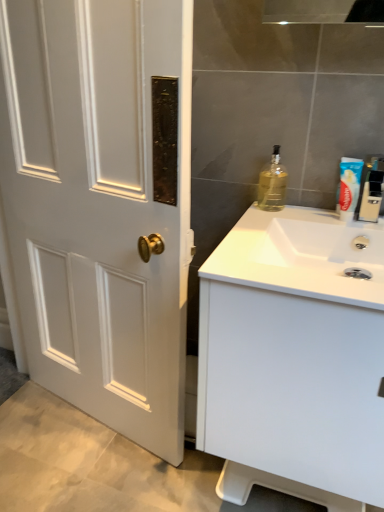
This screenshot has width=384, height=512. I want to click on blue plastic toothpaste at upper right, so click(x=348, y=187).

Where is `translucent glass bottle at upper right, the second bottle in the right-to-left sequence`? The height and width of the screenshot is (512, 384). translucent glass bottle at upper right, the second bottle in the right-to-left sequence is located at coordinates (272, 184).

Measure the distance between point (372, 175) and camera.

They are 1.07 meters apart.

This screenshot has width=384, height=512. What do you see at coordinates (301, 256) in the screenshot?
I see `white glossy sink at right` at bounding box center [301, 256].

Find the location of a particular element. This screenshot has width=384, height=512. blue plastic toothpaste at upper right is located at coordinates (348, 187).

Considering the sizes of clear plastic toothpaste tube at upper right, marked as the first bottle in a right-to-left arrangement, and translucent glass bottle at upper right, which ranks as the 1th bottle in left-to-right order, in the image, is clear plastic toothpaste tube at upper right, marked as the first bottle in a right-to-left arrangement, wider or thinner than translucent glass bottle at upper right, which ranks as the 1th bottle in left-to-right order,?

clear plastic toothpaste tube at upper right, marked as the first bottle in a right-to-left arrangement, is wider than translucent glass bottle at upper right, which ranks as the 1th bottle in left-to-right order.

How many degrees apart are the facing directions of clear plastic toothpaste tube at upper right, marked as the first bottle in a right-to-left arrangement, and translucent glass bottle at upper right, which ranks as the 1th bottle in left-to-right order?

The angle between the facing direction of clear plastic toothpaste tube at upper right, marked as the first bottle in a right-to-left arrangement, and the facing direction of translucent glass bottle at upper right, which ranks as the 1th bottle in left-to-right order, is 1.35 degrees.

Considering the relative sizes of clear plastic toothpaste tube at upper right, which appears as the second bottle when viewed from the left, and translucent glass bottle at upper right, the second bottle in the right-to-left sequence, in the image provided, is clear plastic toothpaste tube at upper right, which appears as the second bottle when viewed from the left, shorter than translucent glass bottle at upper right, the second bottle in the right-to-left sequence,?

No.

Does clear plastic toothpaste tube at upper right, which appears as the second bottle when viewed from the left, have a smaller size compared to blue plastic toothpaste at upper right?

Incorrect, clear plastic toothpaste tube at upper right, which appears as the second bottle when viewed from the left, is not smaller in size than blue plastic toothpaste at upper right.

Which is farther, (377, 160) or (344, 164)?

The point (377, 160) is farther.

Can you confirm if clear plastic toothpaste tube at upper right, marked as the first bottle in a right-to-left arrangement, is thinner than blue plastic toothpaste at upper right?

No.

From the image's perspective, between blue plastic toothpaste at upper right and white matte cabinet at right, who is located below?

white matte cabinet at right.

In terms of height, does blue plastic toothpaste at upper right look taller or shorter compared to white matte cabinet at right?

Considering their sizes, blue plastic toothpaste at upper right has less height than white matte cabinet at right.

Is blue plastic toothpaste at upper right to the right of white matte cabinet at right from the viewer's perspective?

Correct, you'll find blue plastic toothpaste at upper right to the right of white matte cabinet at right.

Locate an element on the screen. Image resolution: width=384 pixels, height=512 pixels. mouthwash located above the white matte cabinet at right (from a real-world perspective) is located at coordinates (348, 187).

Looking at this image, can we say translucent glass bottle at upper right, which ranks as the 1th bottle in left-to-right order, lies outside white matte cabinet at right?

Absolutely, translucent glass bottle at upper right, which ranks as the 1th bottle in left-to-right order, is external to white matte cabinet at right.

From the image's perspective, is translucent glass bottle at upper right, the second bottle in the right-to-left sequence, above white matte cabinet at right?

Yes, from the image's perspective, translucent glass bottle at upper right, the second bottle in the right-to-left sequence, is on top of white matte cabinet at right.

Where is `bathroom cabinet that is below the translucent glass bottle at upper right, which ranks as the 1th bottle in left-to-right order (from the image's perspective)`? bathroom cabinet that is below the translucent glass bottle at upper right, which ranks as the 1th bottle in left-to-right order (from the image's perspective) is located at coordinates (294, 359).

Which object is wider, translucent glass bottle at upper right, the second bottle in the right-to-left sequence, or clear plastic toothpaste tube at upper right, which appears as the second bottle when viewed from the left?

clear plastic toothpaste tube at upper right, which appears as the second bottle when viewed from the left.

Is translucent glass bottle at upper right, which ranks as the 1th bottle in left-to-right order, at the right side of clear plastic toothpaste tube at upper right, marked as the first bottle in a right-to-left arrangement?

In fact, translucent glass bottle at upper right, which ranks as the 1th bottle in left-to-right order, is to the left of clear plastic toothpaste tube at upper right, marked as the first bottle in a right-to-left arrangement.

How many degrees apart are the facing directions of translucent glass bottle at upper right, which ranks as the 1th bottle in left-to-right order, and clear plastic toothpaste tube at upper right, marked as the first bottle in a right-to-left arrangement?

1.35 degrees.

I want to click on bottle located on the left of blue plastic toothpaste at upper right, so coord(272,184).

Would you consider translucent glass bottle at upper right, which ranks as the 1th bottle in left-to-right order, to be distant from blue plastic toothpaste at upper right?

They are positioned close to each other.

Is translucent glass bottle at upper right, the second bottle in the right-to-left sequence, to the right of blue plastic toothpaste at upper right from the viewer's perspective?

Incorrect, translucent glass bottle at upper right, the second bottle in the right-to-left sequence, is not on the right side of blue plastic toothpaste at upper right.

Does white glossy sink at right have a greater height compared to translucent glass bottle at upper right, which ranks as the 1th bottle in left-to-right order?

Incorrect, the height of white glossy sink at right is not larger of that of translucent glass bottle at upper right, which ranks as the 1th bottle in left-to-right order.

Does point (250, 258) appear closer or farther from the camera than point (282, 174)?

Point (250, 258) is closer to the camera than point (282, 174).

Is white glossy sink at right to the left of translucent glass bottle at upper right, which ranks as the 1th bottle in left-to-right order, from the viewer's perspective?

No, white glossy sink at right is not to the left of translucent glass bottle at upper right, which ranks as the 1th bottle in left-to-right order.

Are white glossy sink at right and translucent glass bottle at upper right, the second bottle in the right-to-left sequence, far apart?

They are positioned close to each other.

Locate an element on the screen. The image size is (384, 512). bottle that is above the clear plastic toothpaste tube at upper right, which appears as the second bottle when viewed from the left (from a real-world perspective) is located at coordinates (272, 184).

This screenshot has height=512, width=384. Find the location of `mouthwash that appears behind the clear plastic toothpaste tube at upper right, which appears as the second bottle when viewed from the left`. mouthwash that appears behind the clear plastic toothpaste tube at upper right, which appears as the second bottle when viewed from the left is located at coordinates (348, 187).

Estimate the real-world distances between objects in this image. Which object is closer to blue plastic toothpaste at upper right, white matte cabinet at right or translucent glass bottle at upper right, the second bottle in the right-to-left sequence?

Based on the image, translucent glass bottle at upper right, the second bottle in the right-to-left sequence, appears to be nearer to blue plastic toothpaste at upper right.

Looking at this image, considering their positions, is clear plastic toothpaste tube at upper right, which appears as the second bottle when viewed from the left, positioned further to white glossy sink at right than white matte cabinet at right?

clear plastic toothpaste tube at upper right, which appears as the second bottle when viewed from the left, is further to white glossy sink at right.

From the image, which object appears to be farther from clear plastic toothpaste tube at upper right, marked as the first bottle in a right-to-left arrangement, white matte cabinet at right or white glossy sink at right?

Among the two, white matte cabinet at right is located further to clear plastic toothpaste tube at upper right, marked as the first bottle in a right-to-left arrangement.

When comparing their distances from white glossy sink at right, does blue plastic toothpaste at upper right or clear plastic toothpaste tube at upper right, marked as the first bottle in a right-to-left arrangement, seem closer?

blue plastic toothpaste at upper right lies closer to white glossy sink at right than the other object.

Which object lies further to the anchor point translucent glass bottle at upper right, which ranks as the 1th bottle in left-to-right order, clear plastic toothpaste tube at upper right, marked as the first bottle in a right-to-left arrangement, or blue plastic toothpaste at upper right?

clear plastic toothpaste tube at upper right, marked as the first bottle in a right-to-left arrangement, lies further to translucent glass bottle at upper right, which ranks as the 1th bottle in left-to-right order, than the other object.

Considering their positions, is blue plastic toothpaste at upper right positioned further to white matte cabinet at right than clear plastic toothpaste tube at upper right, marked as the first bottle in a right-to-left arrangement?

clear plastic toothpaste tube at upper right, marked as the first bottle in a right-to-left arrangement.

In the scene shown: Based on their spatial positions, is translucent glass bottle at upper right, which ranks as the 1th bottle in left-to-right order, or blue plastic toothpaste at upper right further from white matte cabinet at right?

Based on the image, translucent glass bottle at upper right, which ranks as the 1th bottle in left-to-right order, appears to be further to white matte cabinet at right.

From the image, which object appears to be nearer to clear plastic toothpaste tube at upper right, marked as the first bottle in a right-to-left arrangement, white glossy sink at right or white matte cabinet at right?

Among the two, white glossy sink at right is located nearer to clear plastic toothpaste tube at upper right, marked as the first bottle in a right-to-left arrangement.

At what (x,y) coordinates should I click in order to perform the action: click on mouthwash that lies between translucent glass bottle at upper right, the second bottle in the right-to-left sequence, and white matte cabinet at right from top to bottom. Please return your answer as a coordinate pair (x, y). The width and height of the screenshot is (384, 512). Looking at the image, I should click on (348, 187).

Find the location of a particular element. bottle between white glossy sink at right and blue plastic toothpaste at upper right along the z-axis is located at coordinates click(x=371, y=189).

Find the location of `mouthwash between white glossy sink at right and translucent glass bottle at upper right, the second bottle in the right-to-left sequence, along the z-axis`. mouthwash between white glossy sink at right and translucent glass bottle at upper right, the second bottle in the right-to-left sequence, along the z-axis is located at coordinates (348, 187).

The height and width of the screenshot is (512, 384). I want to click on bottle between translucent glass bottle at upper right, which ranks as the 1th bottle in left-to-right order, and white matte cabinet at right vertically, so click(371, 189).